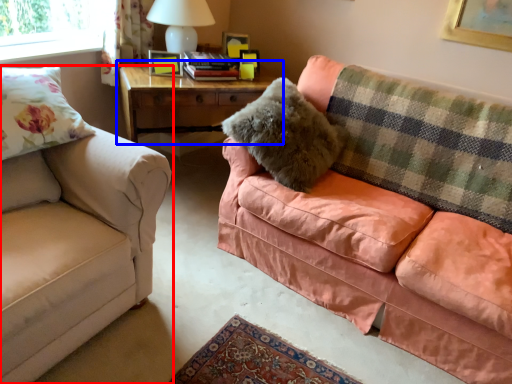
Question: Among these objects, which one is nearest to the camera, studio couch (highlighted by a red box) or table (highlighted by a blue box)?

Choices:
 (A) studio couch
 (B) table

Answer: (A)